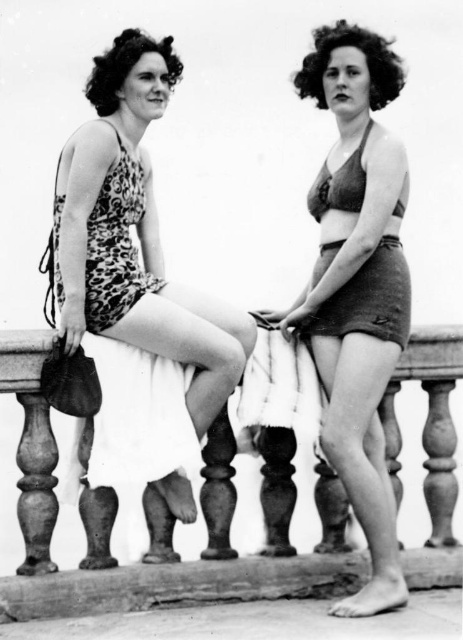
Question: Which object is farther from the camera taking this photo?

Choices:
 (A) matte brown bikini top at center
 (B) wooden balustrade at center

Answer: (A)

Question: Does leopard print swimsuit at left have a greater width compared to matte brown bikini top at center?

Choices:
 (A) yes
 (B) no

Answer: (A)

Question: Which object is the farthest from the wooden balustrade at center?

Choices:
 (A) matte brown shorts at center
 (B) matte brown bikini top at center
 (C) leopard print swimsuit at left

Answer: (B)

Question: Is matte brown shorts at center smaller than matte brown bikini top at center?

Choices:
 (A) no
 (B) yes

Answer: (A)

Question: Does leopard print swimsuit at left appear over wooden balustrade at center?

Choices:
 (A) no
 (B) yes

Answer: (B)

Question: Which of the following is the farthest from the observer?

Choices:
 (A) (355, 200)
 (B) (374, 385)

Answer: (A)